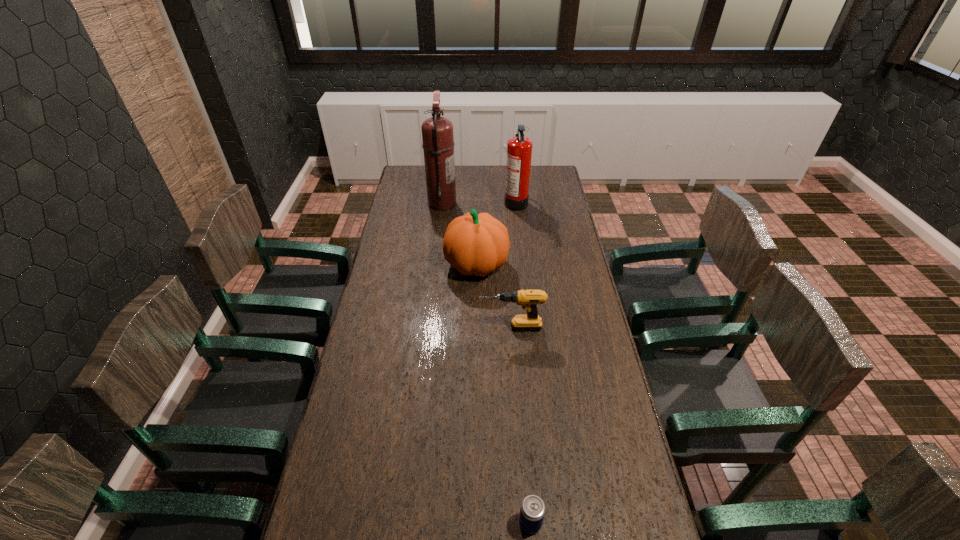
Where is `free spot that satisfies the following two spatial constraints: 1. on the front-facing side of the right fire extinguisher; 2. on the front side of the beer can`? Image resolution: width=960 pixels, height=540 pixels. free spot that satisfies the following two spatial constraints: 1. on the front-facing side of the right fire extinguisher; 2. on the front side of the beer can is located at coordinates (552, 522).

This screenshot has height=540, width=960. Find the location of `vacant position in the image that satisfies the following two spatial constraints: 1. on the front-facing side of the right fire extinguisher; 2. on the front side of the third farthest object`. vacant position in the image that satisfies the following two spatial constraints: 1. on the front-facing side of the right fire extinguisher; 2. on the front side of the third farthest object is located at coordinates (523, 265).

Identify the location of vacant point that satisfies the following two spatial constraints: 1. on the back side of the third nearest object; 2. on the front-facing side of the tallest object. This screenshot has width=960, height=540. (477, 203).